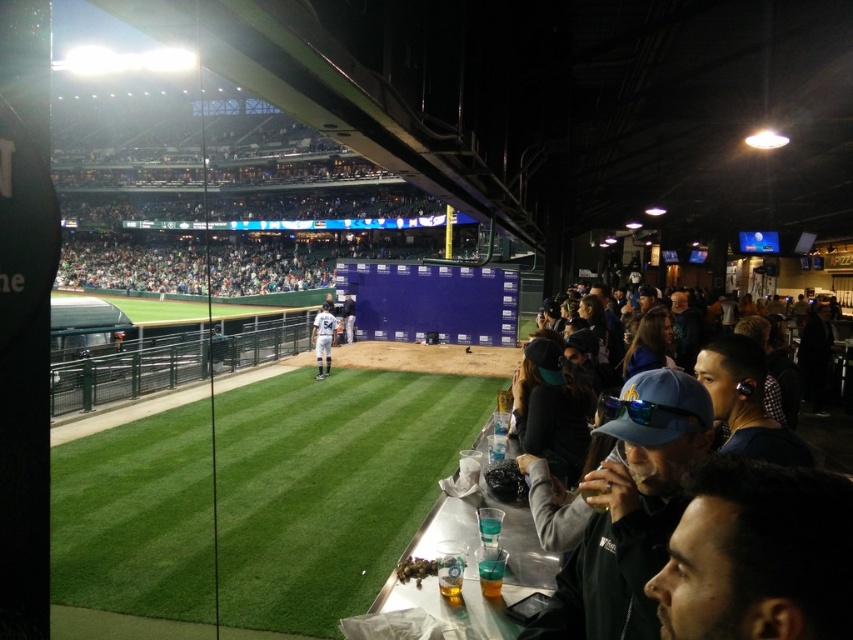
You are a photographer at the baseball stadium and need to capture a clear shot of both the white uniform at center and the white jersey at center. Since both are in the same area, which one would you focus on first to ensure it appears larger in your photo?

The white uniform at center has a larger size compared to the white jersey at center, so you should focus on the white uniform at center first to ensure it appears larger in the photo.

You are a photographer standing at the edge of the baseball field. You want to take a photo that includes both the green artificial turf at center and the white jersey at center. Which object should you focus on first to ensure both are in clear view?

You should focus on the green artificial turf at center first because it is closer to the viewer than the white jersey at center. By focusing on the closer object, both will be in clear view due to depth of field.